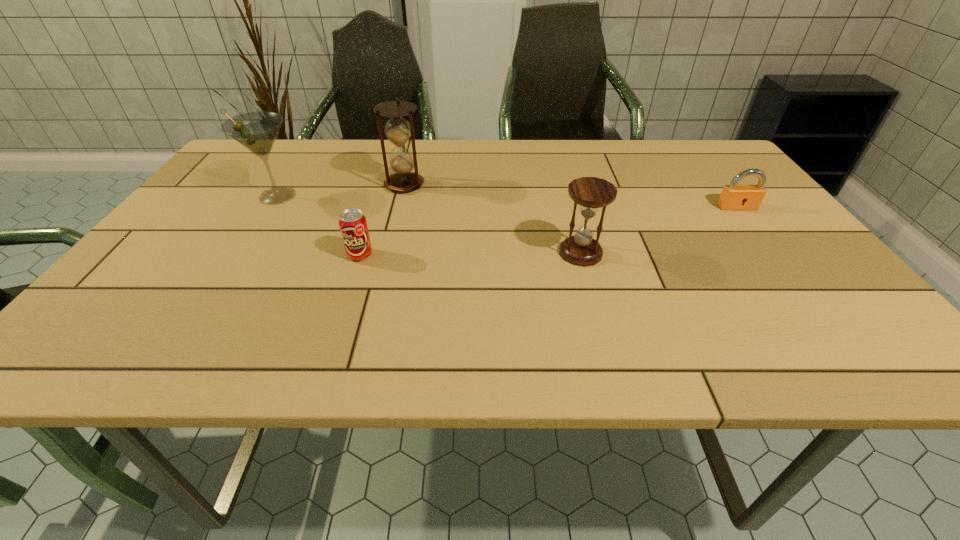
Image resolution: width=960 pixels, height=540 pixels. What are the coordinates of `vacant region at the far right corner` in the screenshot? It's located at (689, 170).

The width and height of the screenshot is (960, 540). I want to click on vacant point located between the leftmost object and the left hourglass, so pos(341,190).

The height and width of the screenshot is (540, 960). In order to click on free space between the left hourglass and the leftmost object in this screenshot , I will do `click(341, 190)`.

Locate an element on the screen. Image resolution: width=960 pixels, height=540 pixels. free space between the taller hourglass and the fourth object from left to right is located at coordinates (492, 219).

Where is `free space between the farther hourglass and the soda`? This screenshot has height=540, width=960. free space between the farther hourglass and the soda is located at coordinates (382, 220).

Find the location of a particular element. The image size is (960, 540). vacant area that lies between the rightmost object and the martini is located at coordinates (507, 201).

Identify the location of free space between the leftmost object and the taller hourglass. (341, 190).

Where is `vacant region between the second object from right to left and the left hourglass`? Image resolution: width=960 pixels, height=540 pixels. vacant region between the second object from right to left and the left hourglass is located at coordinates (492, 219).

Locate an element on the screen. empty space between the third shortest object and the soda is located at coordinates (470, 254).

Where is `free area in between the nearer hourglass and the martini`? free area in between the nearer hourglass and the martini is located at coordinates (429, 224).